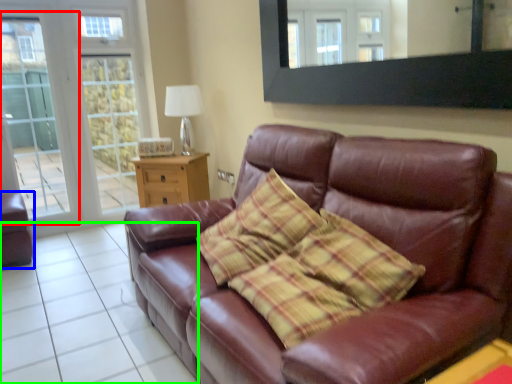
Question: Considering the real-world distances, which object is farthest from screen door (highlighted by a red box)? armchair (highlighted by a blue box) or tile (highlighted by a green box)?

Choices:
 (A) armchair
 (B) tile

Answer: (B)